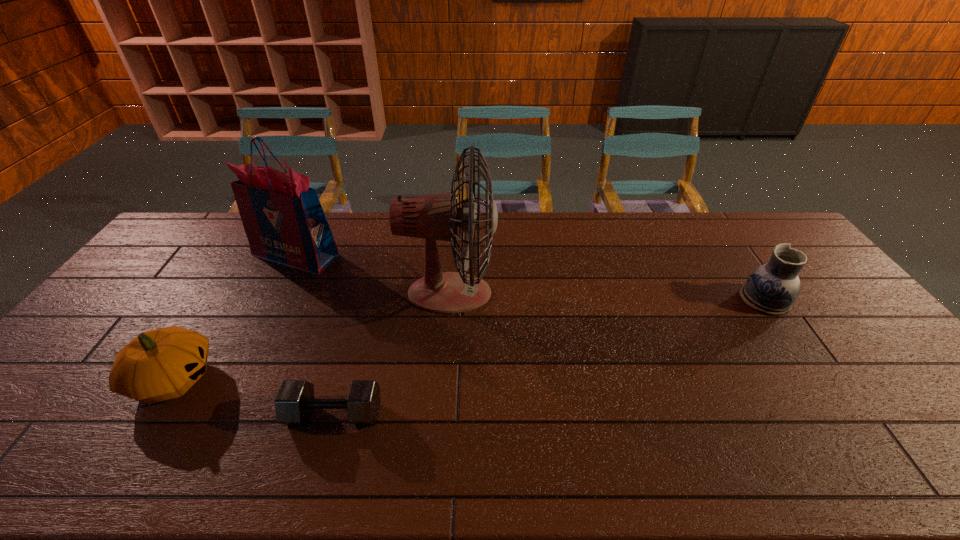
At what (x,y) coordinates should I click in order to perform the action: click on free region located 0.160m on the back of the third object from left to right. Please return your answer as a coordinate pair (x, y). The width and height of the screenshot is (960, 540). Looking at the image, I should click on click(x=353, y=346).

The height and width of the screenshot is (540, 960). In order to click on object positioned at the far edge in this screenshot , I will do `click(283, 219)`.

Find the location of a particular element. vacant space at the far edge is located at coordinates (653, 239).

Image resolution: width=960 pixels, height=540 pixels. I want to click on vacant space at the near edge of the desktop, so click(x=902, y=460).

In order to click on free spot at the left edge of the desktop in this screenshot , I will do `click(59, 360)`.

In the image, there is a desktop. At what (x,y) coordinates should I click in order to perform the action: click on vacant space at the far left corner. Please return your answer as a coordinate pair (x, y). The height and width of the screenshot is (540, 960). Looking at the image, I should click on (208, 245).

What are the coordinates of `vacant region at the far right corner of the desktop` in the screenshot? It's located at (777, 227).

Where is `free point between the third object from left to right and the fan`? Image resolution: width=960 pixels, height=540 pixels. free point between the third object from left to right and the fan is located at coordinates (393, 354).

Where is `free space between the rightmost object and the third object from right to left`? The height and width of the screenshot is (540, 960). free space between the rightmost object and the third object from right to left is located at coordinates (549, 357).

You are a GUI agent. You are given a task and a screenshot of the screen. Output one action in this format:
    pyautogui.click(x=<x>, y=<y>)
    Task: Click on the blank region between the shortest object and the grocery bag
    The height and width of the screenshot is (540, 960).
    Given the screenshot: What is the action you would take?
    coord(315,335)